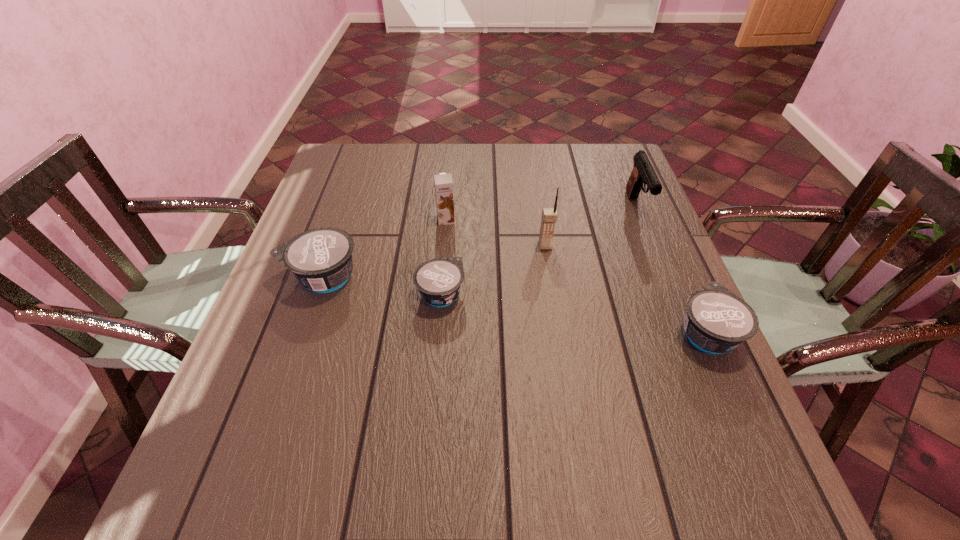
What are the coordinates of `blank space located on the left of the shortest object` in the screenshot? It's located at (326, 294).

This screenshot has width=960, height=540. What are the coordinates of `blank space located 0.240m on the back of the second tallest yogurt` in the screenshot? It's located at (662, 233).

At what (x,y) coordinates should I click in order to perform the action: click on vacant space situated 0.070m at the barrel of the pistol. Please return your answer as a coordinate pair (x, y). The height and width of the screenshot is (540, 960). Looking at the image, I should click on (652, 246).

In order to click on vacant area situated 0.260m on the front of the tallest object, where the keypad is located in this screenshot , I will do `click(560, 336)`.

I want to click on free spot located 0.370m on the front of the chocolate milk, so click(x=435, y=342).

In order to click on object present at the left edge in this screenshot , I will do `click(321, 258)`.

The height and width of the screenshot is (540, 960). What are the coordinates of `yogurt that is at the right edge` in the screenshot? It's located at (717, 321).

Identify the location of pistol that is at the right edge. [643, 172].

The image size is (960, 540). What are the coordinates of `vacant space at the far edge of the desktop` in the screenshot? It's located at (468, 167).

The width and height of the screenshot is (960, 540). I want to click on vacant space at the near edge of the desktop, so click(401, 399).